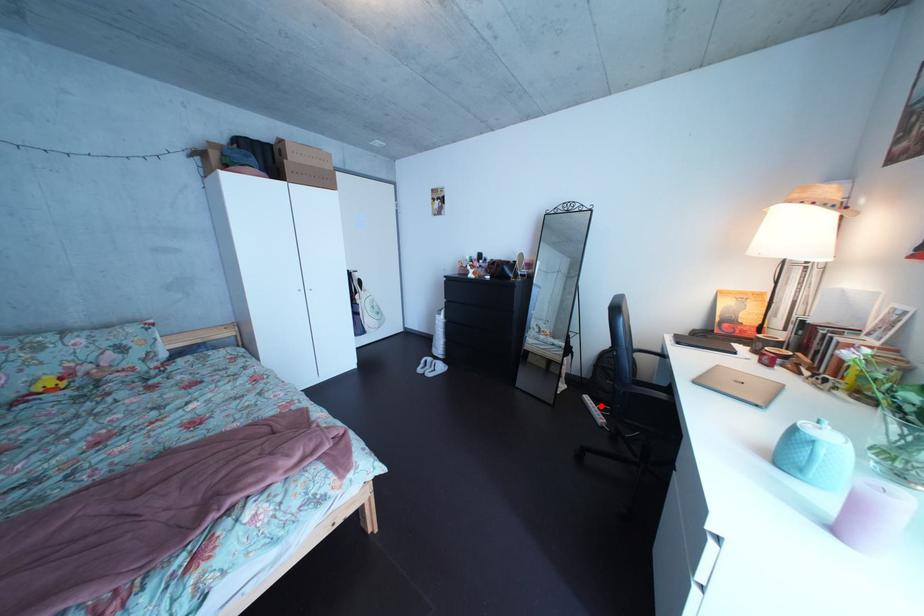
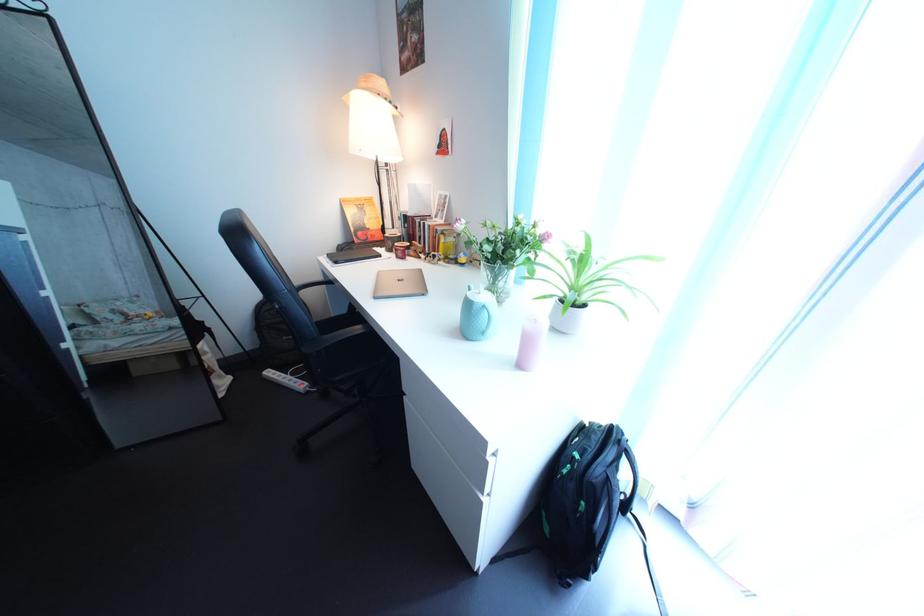
Locate, in the second image, the point that corresponds to the highlighted location in the first image.

(284, 381)